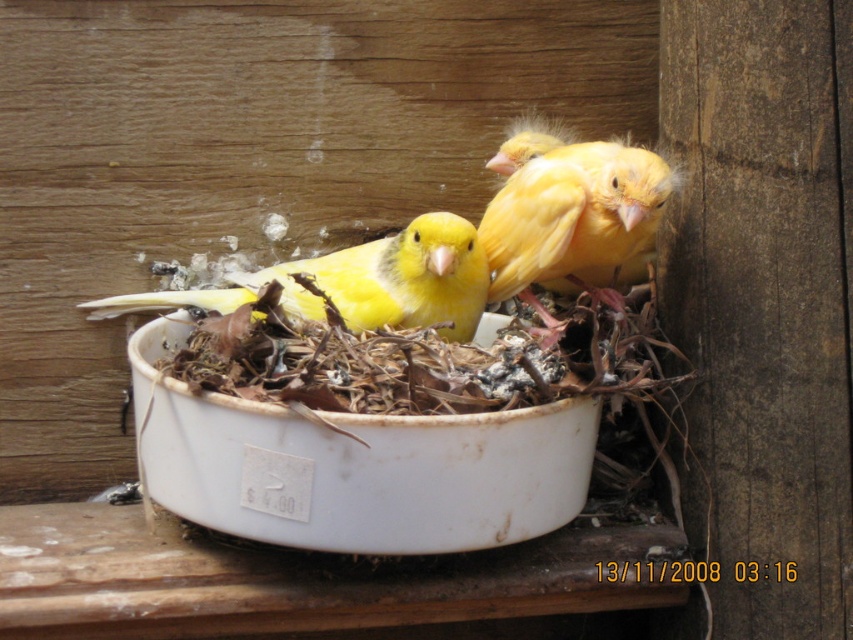
Looking at this image, you are a customer at a pet store and see the yellow matte bird at center in a container. If you want to place a small treat exactly where the bird is currently standing, what are the coordinates you should target?

The yellow matte bird at center is located at point [569,216], so you should target those coordinates to place the treat where the bird is currently standing.

You are a customer at a pet store looking at the yellow matte bird at center and the matte yellow canary at center in a container. The store has a height restriction for bird cages. If the cage you have can only accommodate birds up to the height of the smaller one, which bird should you avoid buying?

You should avoid buying the yellow matte bird at center because it is much taller than the matte yellow canary at center, exceeding the cage height limit.

You are a customer at a pet store and want to know if there is enough space between the yellow matte bird at center and the matte yellow canary at center to place a small food dish. The dish requires 5 inches of space. Can you fit it between them?

The distance between the yellow matte bird at center and the matte yellow canary at center is 4.76 inches, which is less than the required 5 inches. Therefore, the dish cannot be placed between them.